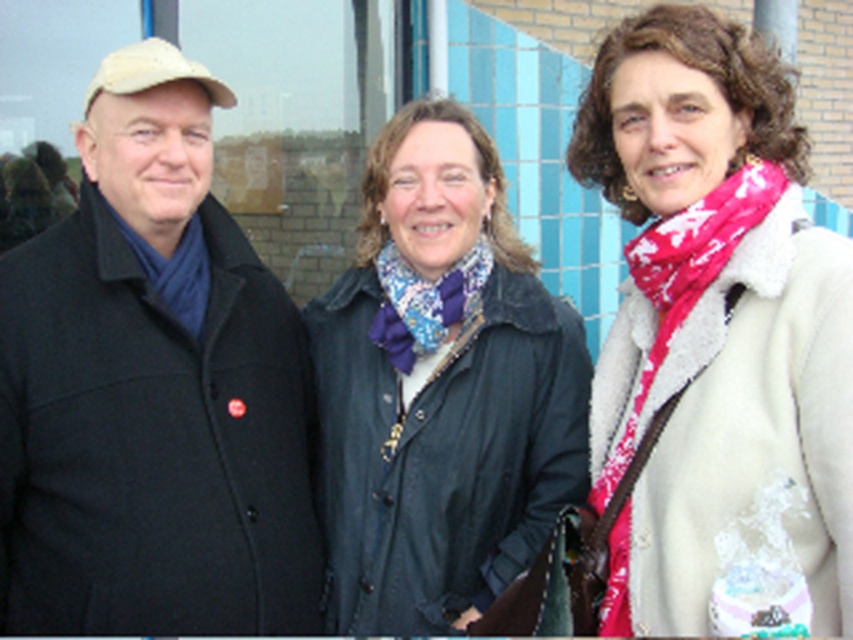
Question: Which of these objects is positioned closest to the black wool coat at left?

Choices:
 (A) pink printed scarf at center
 (B) blue textured scarf at center

Answer: (B)

Question: Considering the real-world distances, which object is closest to the blue textured scarf at center?

Choices:
 (A) black wool coat at left
 (B) pink printed scarf at center

Answer: (A)

Question: Which point appears farthest from the camera in this image?

Choices:
 (A) (749, 525)
 (B) (350, 468)

Answer: (B)

Question: Can you confirm if pink printed scarf at center is positioned above blue textured scarf at center?

Choices:
 (A) no
 (B) yes

Answer: (B)

Question: Is black wool coat at left closer to the viewer compared to blue textured scarf at center?

Choices:
 (A) yes
 (B) no

Answer: (A)

Question: From the image, what is the correct spatial relationship of black wool coat at left in relation to pink printed scarf at center?

Choices:
 (A) below
 (B) above

Answer: (A)